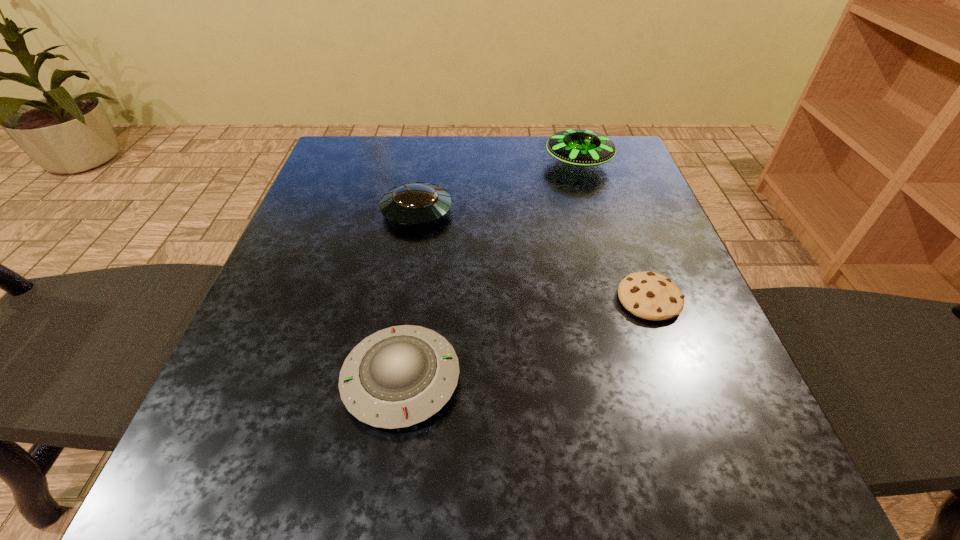
The image size is (960, 540). Identify the location of the tallest saucer. (582, 147).

I want to click on the tallest object, so click(582, 147).

Identify the location of the second farthest object. Image resolution: width=960 pixels, height=540 pixels. (418, 203).

Identify the location of the nearest object. This screenshot has height=540, width=960. (400, 376).

Image resolution: width=960 pixels, height=540 pixels. Identify the location of the shortest object. (648, 295).

What are the coordinates of `cookie` in the screenshot? It's located at (648, 295).

I want to click on vacant space located 0.360m on the left of the farthest object, so click(x=398, y=163).

Image resolution: width=960 pixels, height=540 pixels. In order to click on vacant area situated 0.170m on the right of the second farthest object in this screenshot , I will do `click(532, 211)`.

Where is `vacant space located on the back of the nearest saucer`? Image resolution: width=960 pixels, height=540 pixels. vacant space located on the back of the nearest saucer is located at coordinates (414, 293).

Find the location of a particular element. This screenshot has width=960, height=540. free space located on the left of the third farthest object is located at coordinates (450, 299).